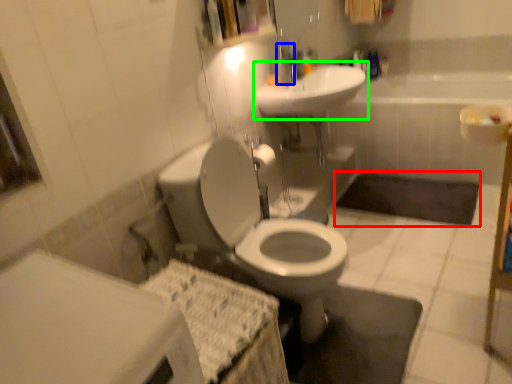
Question: Considering the real-world distances, which object is closest to bath mat (highlighted by a red box)? faucet (highlighted by a blue box) or sink (highlighted by a green box).

Choices:
 (A) faucet
 (B) sink

Answer: (B)